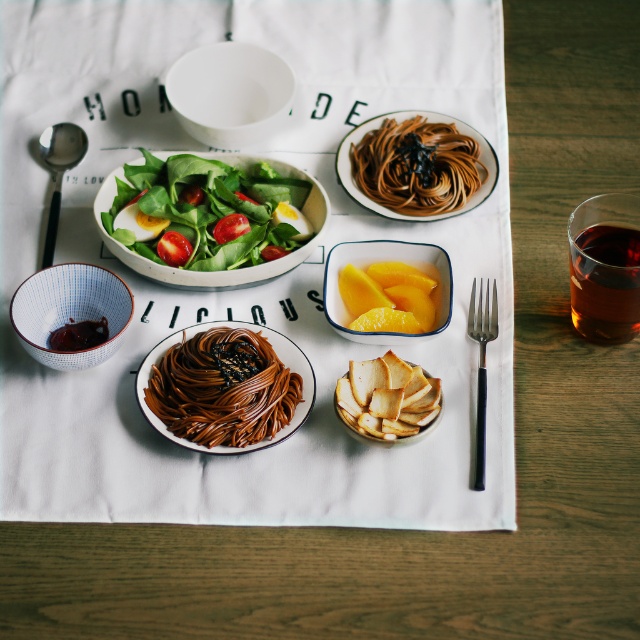
You are a delivery drone approaching the wooden table where the meal is set up. You need to land at one of the two points marked as point 1 at (x=211, y=160) and point 2 at (x=442, y=273). Which point is closer to the salad bowl at center?

Point 1 at (x=211, y=160) is closer to the salad bowl at center because it is positioned behind point 2 at (x=442, y=273), meaning point 1 is further away from the salad bowl.

You are a guest at a dinner party and want to reach for both the brown glossy pasta at center and the golden crispy bread at center. Which one is closer to you?

The brown glossy pasta at center is closer to you because the golden crispy bread at center is behind it.